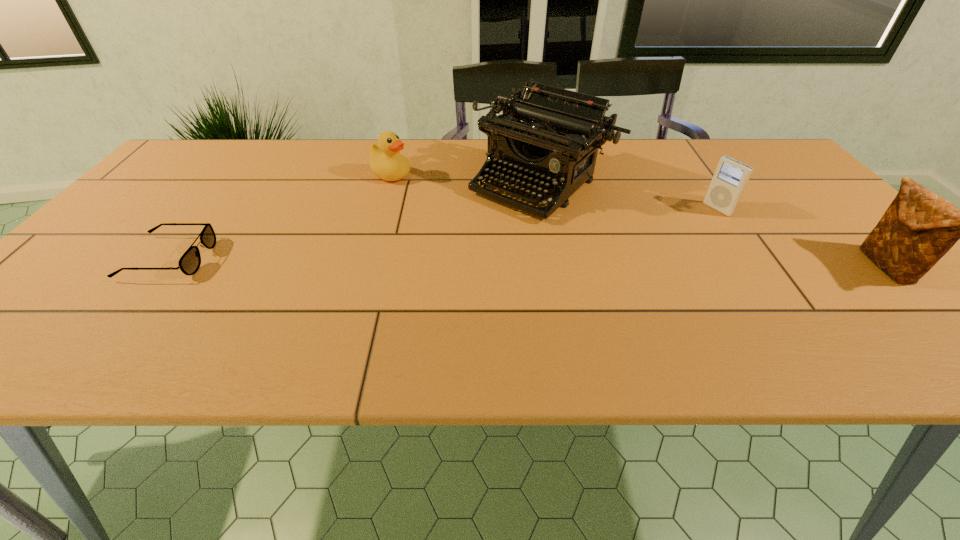
The width and height of the screenshot is (960, 540). What are the coordinates of `empty space that is in between the tallest object and the duck` in the screenshot? It's located at (467, 179).

Find the location of a particular element. The width and height of the screenshot is (960, 540). object that can be found as the third closest to the spectacles is located at coordinates (730, 178).

Image resolution: width=960 pixels, height=540 pixels. I want to click on object that ranks as the closest to the fourth object from left to right, so click(x=550, y=136).

Find the location of a particular element. This screenshot has width=960, height=540. vacant space that satisfies the following two spatial constraints: 1. on the front side of the rightmost object; 2. on the open side of the second object from left to right is located at coordinates (365, 267).